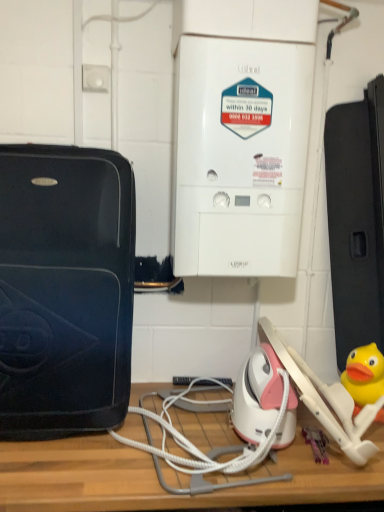
Question: Does white plastic boiler at center, the 1th home appliance in the right-to-left sequence, have a smaller size compared to white cord at center?

Choices:
 (A) no
 (B) yes

Answer: (A)

Question: Is white plastic boiler at center, placed as the second home appliance when sorted from left to right, positioned beyond the bounds of white cord at center?

Choices:
 (A) no
 (B) yes

Answer: (B)

Question: Does white plastic boiler at center, the 1th home appliance in the right-to-left sequence, have a greater width compared to white cord at center?

Choices:
 (A) no
 (B) yes

Answer: (A)

Question: Considering the relative sizes of white plastic boiler at center, placed as the second home appliance when sorted from left to right, and white cord at center in the image provided, is white plastic boiler at center, placed as the second home appliance when sorted from left to right, taller than white cord at center?

Choices:
 (A) no
 (B) yes

Answer: (B)

Question: Is the surface of white plastic boiler at center, placed as the second home appliance when sorted from left to right, in direct contact with white cord at center?

Choices:
 (A) yes
 (B) no

Answer: (B)

Question: Does white plastic boiler at center, placed as the second home appliance when sorted from left to right, have a lesser height compared to white cord at center?

Choices:
 (A) yes
 (B) no

Answer: (B)

Question: Is white cord at center bigger than wooden table at center?

Choices:
 (A) no
 (B) yes

Answer: (A)

Question: Are white cord at center and wooden table at center far apart?

Choices:
 (A) no
 (B) yes

Answer: (A)

Question: From the image's perspective, does white cord at center appear higher than wooden table at center?

Choices:
 (A) yes
 (B) no

Answer: (A)

Question: Can you confirm if white cord at center is taller than wooden table at center?

Choices:
 (A) yes
 (B) no

Answer: (B)

Question: Is white cord at center smaller than wooden table at center?

Choices:
 (A) yes
 (B) no

Answer: (A)

Question: Is white cord at center facing towards wooden table at center?

Choices:
 (A) yes
 (B) no

Answer: (B)

Question: From a real-world perspective, is matte black suitcase at left, which is the first home appliance in left-to-right order, positioned over white cord at center based on gravity?

Choices:
 (A) yes
 (B) no

Answer: (A)